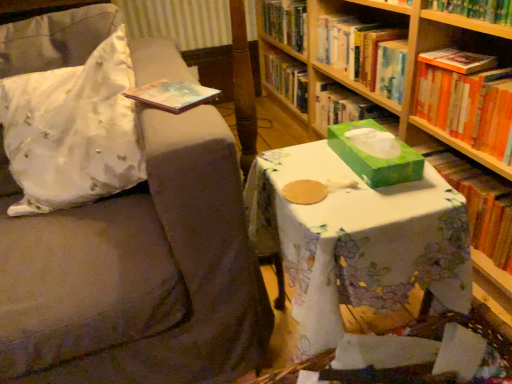
Locate an element on the screen. Image resolution: width=512 pixels, height=384 pixels. empty space that is ontop of floral-patterned cloth at center (from a real-world perspective) is located at coordinates (331, 175).